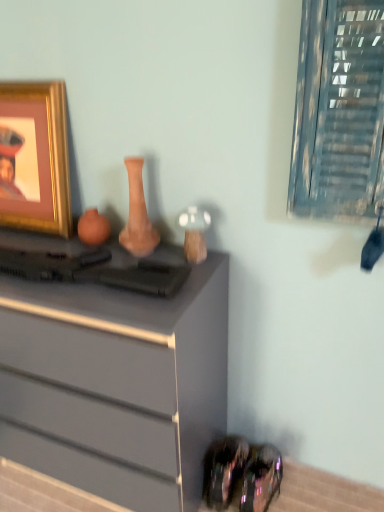
This screenshot has width=384, height=512. Find the location of `matte gray chest of drawers at center`. matte gray chest of drawers at center is located at coordinates (116, 384).

Where is `metallic glass window at upper right`? The image size is (384, 512). metallic glass window at upper right is located at coordinates (339, 112).

What do you see at coordinates (224, 469) in the screenshot?
I see `shiny black shoe at lower right` at bounding box center [224, 469].

The width and height of the screenshot is (384, 512). What are the coordinates of `matte gray chest of drawers at center` in the screenshot? It's located at tap(116, 384).

From a real-world perspective, which object rests below the other?

→ matte gray chest of drawers at center, from a real-world perspective.

Is matte gray chest of drawers at center far away from gold metallic picture frame at upper left?

No, matte gray chest of drawers at center is in close proximity to gold metallic picture frame at upper left.

Is point (195, 341) closer or farther from the camera than point (28, 173)?

Point (195, 341).

Which object is thinner, matte gray chest of drawers at center or gold metallic picture frame at upper left?

gold metallic picture frame at upper left.

Is shiny black shoe at lower right taller than metallic glass window at upper right?

No, shiny black shoe at lower right is not taller than metallic glass window at upper right.

Based on the photo, between shiny black shoe at lower right and metallic glass window at upper right, which one is positioned in front?

metallic glass window at upper right is in front.

From the image's perspective, who appears lower, shiny black shoe at lower right or metallic glass window at upper right?

shiny black shoe at lower right.

Could you tell me if matte clay vase at center is turned towards matte gray chest of drawers at center?

No, matte clay vase at center is not aimed at matte gray chest of drawers at center.

How different are the orientations of matte clay vase at center and matte gray chest of drawers at center in degrees?

4.55 degrees.

From the image's perspective, between matte clay vase at center and matte gray chest of drawers at center, which one is located above?

matte clay vase at center.

Between matte clay vase at center and matte gray chest of drawers at center, which one has more height?

matte gray chest of drawers at center is taller.

Is point (240, 469) closer to camera compared to point (164, 365)?

No, it is not.

Does shiny black shoe at lower right come behind matte gray chest of drawers at center?

Yes, the depth of shiny black shoe at lower right is greater than that of matte gray chest of drawers at center.

Could you tell me if shiny black shoe at lower right is turned towards matte gray chest of drawers at center?

No.

Is matte clay vase at center wider or thinner than gold metallic picture frame at upper left?

Clearly, matte clay vase at center has more width compared to gold metallic picture frame at upper left.

Measure the distance between matte clay vase at center and gold metallic picture frame at upper left.

14.15 inches.

Is matte clay vase at center in front of or behind gold metallic picture frame at upper left in the image?

In the image, matte clay vase at center appears in front of gold metallic picture frame at upper left.

Locate an element on the screen. The height and width of the screenshot is (512, 384). vase below the gold metallic picture frame at upper left (from the image's perspective) is located at coordinates (137, 214).

Is matte gray chest of drawers at center at the back of gold metallic picture frame at upper left?

No, gold metallic picture frame at upper left is not facing the opposite direction of matte gray chest of drawers at center.

Is gold metallic picture frame at upper left not within matte gray chest of drawers at center?

Absolutely, gold metallic picture frame at upper left is external to matte gray chest of drawers at center.

Considering their positions, is gold metallic picture frame at upper left located in front of or behind matte gray chest of drawers at center?

gold metallic picture frame at upper left is behind matte gray chest of drawers at center.

Looking at this image, considering the sizes of objects gold metallic picture frame at upper left and matte gray chest of drawers at center in the image provided, who is shorter, gold metallic picture frame at upper left or matte gray chest of drawers at center?

With less height is gold metallic picture frame at upper left.

Considering the positions of objects shiny black shoe at lower right and matte clay vase at center in the image provided, who is in front, shiny black shoe at lower right or matte clay vase at center?

matte clay vase at center.

How distant is shiny black shoe at lower right from matte clay vase at center?

They are 72.94 centimeters apart.

Between shiny black shoe at lower right and matte clay vase at center, which one appears on the left side from the viewer's perspective?

matte clay vase at center is more to the left.

This screenshot has width=384, height=512. What are the coordinates of `the chest of drawers located underneath the gold metallic picture frame at upper left (from a real-world perspective)` in the screenshot? It's located at (116, 384).

The image size is (384, 512). What are the coordinates of `window above the shiny black shoe at lower right (from the image's perspective)` in the screenshot? It's located at (339, 112).

When comparing their distances from gold metallic picture frame at upper left, does metallic glass window at upper right or matte clay vase at center seem closer?

Among the two, matte clay vase at center is located nearer to gold metallic picture frame at upper left.

Which object lies further to the anchor point metallic glass window at upper right, shiny black shoe at lower right or matte clay vase at center?

shiny black shoe at lower right lies further to metallic glass window at upper right than the other object.

Which object lies further to the anchor point matte clay vase at center, gold metallic picture frame at upper left or metallic glass window at upper right?

Among the two, metallic glass window at upper right is located further to matte clay vase at center.

Looking at the image, which one is located further to matte clay vase at center, matte gray chest of drawers at center or gold metallic picture frame at upper left?

Based on the image, matte gray chest of drawers at center appears to be further to matte clay vase at center.

Looking at the image, which one is located further to gold metallic picture frame at upper left, shiny black shoe at lower right or matte gray chest of drawers at center?

shiny black shoe at lower right is further to gold metallic picture frame at upper left.

Looking at the image, which one is located further to metallic glass window at upper right, matte gray chest of drawers at center or matte clay vase at center?

matte gray chest of drawers at center.

Based on their spatial positions, is metallic glass window at upper right or gold metallic picture frame at upper left further from shiny black shoe at lower right?

Among the two, gold metallic picture frame at upper left is located further to shiny black shoe at lower right.

Consider the image. Considering their positions, is shiny black shoe at lower right positioned further to matte gray chest of drawers at center than gold metallic picture frame at upper left?

gold metallic picture frame at upper left is further to matte gray chest of drawers at center.

This screenshot has width=384, height=512. What are the coordinates of `vase between gold metallic picture frame at upper left and shiny black shoe at lower right in the vertical direction` in the screenshot? It's located at (137, 214).

Where is `the chest of drawers that lies between gold metallic picture frame at upper left and shiny black shoe at lower right from top to bottom`? This screenshot has height=512, width=384. the chest of drawers that lies between gold metallic picture frame at upper left and shiny black shoe at lower right from top to bottom is located at coordinates (116, 384).

Find the location of a particular element. The image size is (384, 512). vase situated between matte gray chest of drawers at center and metallic glass window at upper right from left to right is located at coordinates (137, 214).

Identify the location of window between gold metallic picture frame at upper left and shiny black shoe at lower right in the up-down direction. (339, 112).